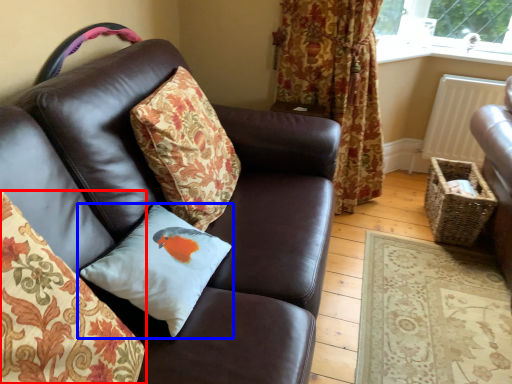
Question: Which object is further to the camera taking this photo, pillow (highlighted by a red box) or pillow (highlighted by a blue box)?

Choices:
 (A) pillow
 (B) pillow

Answer: (B)